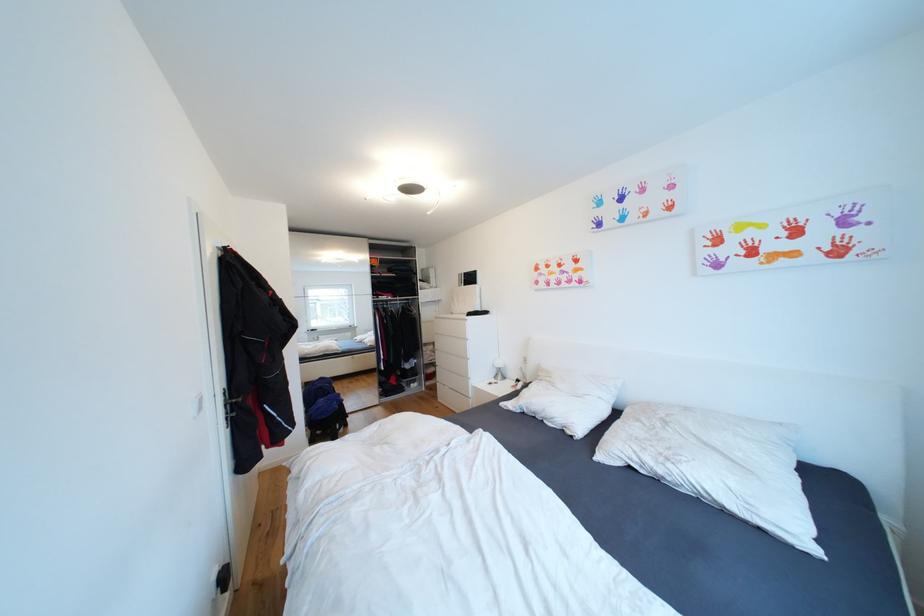
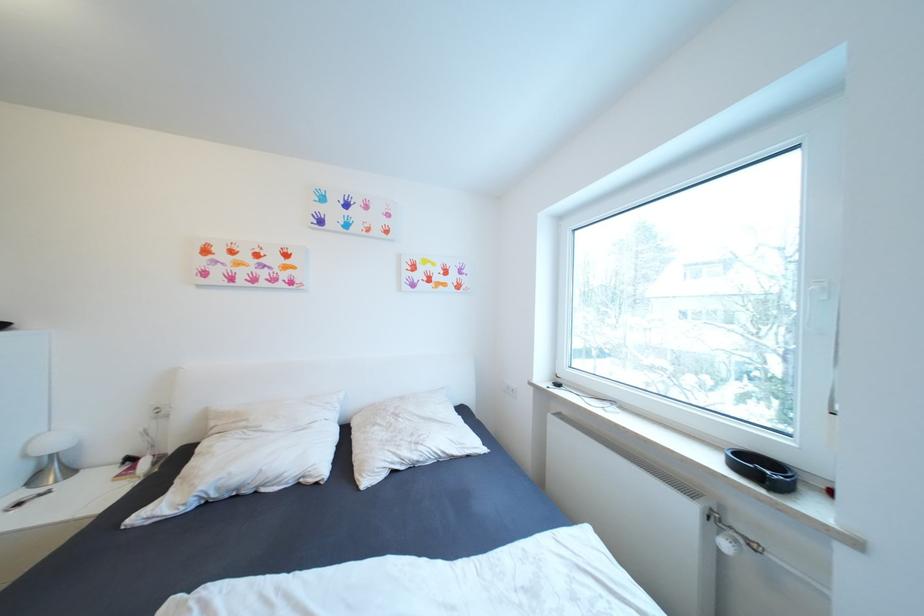
Question: The camera is either moving clockwise (left) or counter-clockwise (right) around the object. The first image is from the beginning of the video and the second image is from the end. Is the camera moving left or right when shooting the video?

Choices:
 (A) Left
 (B) Right

Answer: (A)